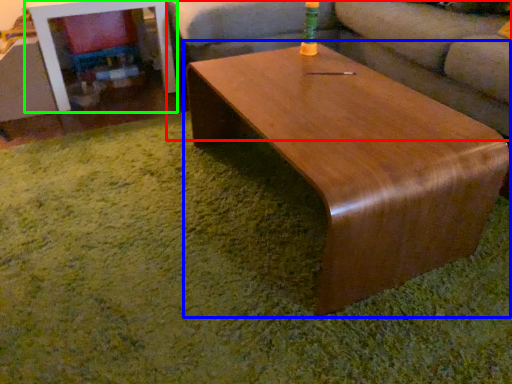
Question: Considering the real-world distances, which object is farthest from studio couch (highlighted by a red box)? coffee table (highlighted by a blue box) or table (highlighted by a green box)?

Choices:
 (A) coffee table
 (B) table

Answer: (B)